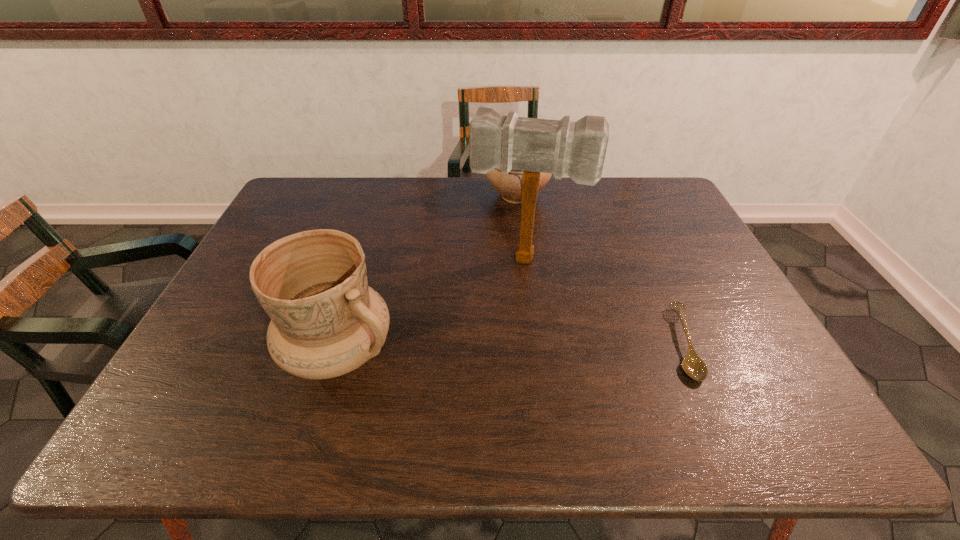
Locate an element on the screen. The width and height of the screenshot is (960, 540). empty space that is in between the mallet and the pottery is located at coordinates (433, 306).

The height and width of the screenshot is (540, 960). I want to click on free space that is in between the farthest object and the shortest object, so click(x=600, y=269).

This screenshot has width=960, height=540. I want to click on object that stands as the second closest to the ladle, so click(x=509, y=186).

Locate an element on the screen. the closest object to the urn is located at coordinates (561, 147).

You are a GUI agent. You are given a task and a screenshot of the screen. Output one action in this format:
    pyautogui.click(x=<x>, y=<y>)
    Task: Click on the free spot that satisfies the following two spatial constraints: 1. on the front side of the tallest object; 2. on the left side of the rightmost object
    The image size is (960, 540).
    Given the screenshot: What is the action you would take?
    (x=538, y=343)

Image resolution: width=960 pixels, height=540 pixels. Find the location of `vacant space that satisfies the following two spatial constraints: 1. on the back side of the mallet; 2. on the right side of the leftmost object`. vacant space that satisfies the following two spatial constraints: 1. on the back side of the mallet; 2. on the right side of the leftmost object is located at coordinates (366, 260).

Locate an element on the screen. This screenshot has width=960, height=540. free location that satisfies the following two spatial constraints: 1. on the front side of the mallet; 2. on the right side of the farthest object is located at coordinates (524, 260).